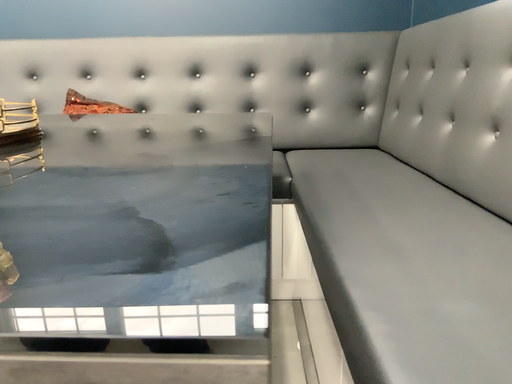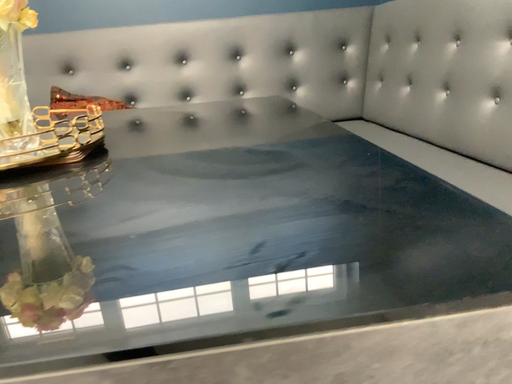
Question: Which way did the camera rotate in the video?

Choices:
 (A) rotated right
 (B) rotated left

Answer: (A)